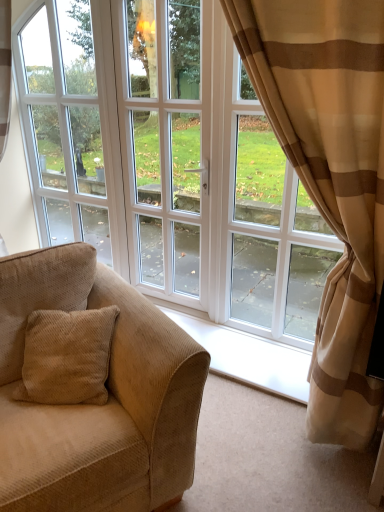
Identify the location of vacant space in front of beige striped curtain at right. (276, 471).